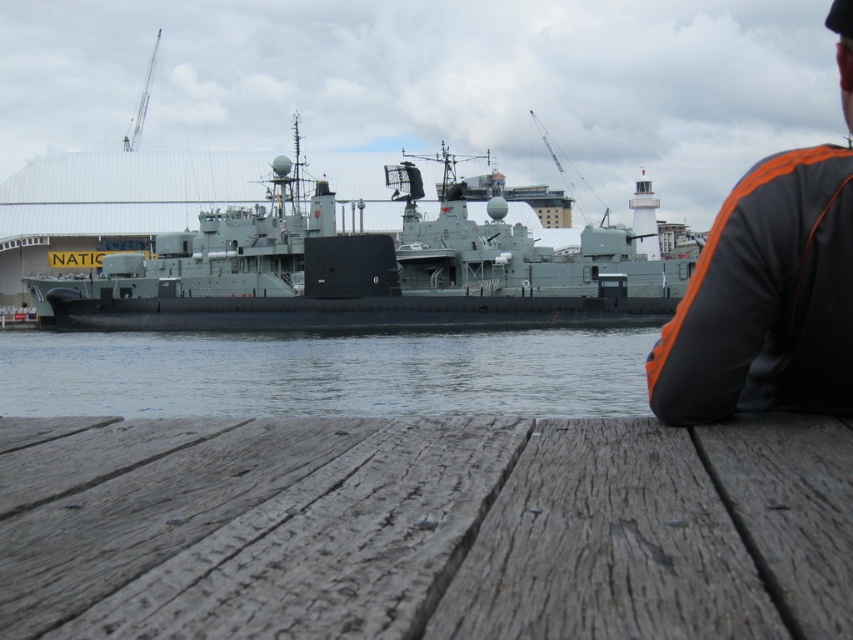
Who is more distant from viewer, (161, 266) or (607, 371)?

Point (161, 266)

Does green matte submarine at center appear under clear water at center?

No.

Image resolution: width=853 pixels, height=640 pixels. What do you see at coordinates (364, 269) in the screenshot? I see `green matte submarine at center` at bounding box center [364, 269].

At what (x,y) coordinates should I click in order to perform the action: click on green matte submarine at center. Please return your answer as a coordinate pair (x, y). Looking at the image, I should click on (364, 269).

Which is more to the right, clear water at center or orange fabric jacket at upper right?

orange fabric jacket at upper right is more to the right.

Consider the image. Does clear water at center have a greater height compared to orange fabric jacket at upper right?

In fact, clear water at center may be shorter than orange fabric jacket at upper right.

Is point (375, 340) positioned behind point (805, 188)?

Yes, it is behind point (805, 188).

What are the coordinates of `clear water at center` in the screenshot? It's located at (325, 372).

Is point (831, 540) less distant than point (831, 368)?

Yes, point (831, 540) is in front of point (831, 368).

Who is more distant from viewer, (115, 570) or (845, 195)?

Positioned behind is point (845, 195).

Identify the location of weathered wood dock at lower center. The height and width of the screenshot is (640, 853). (422, 529).